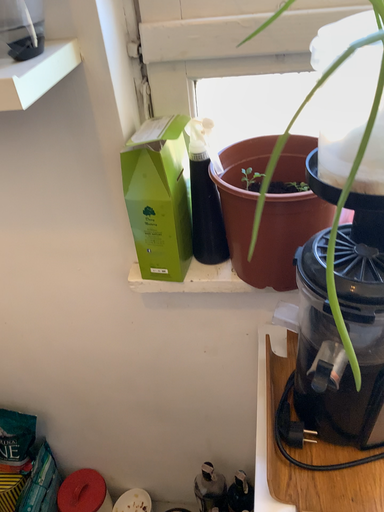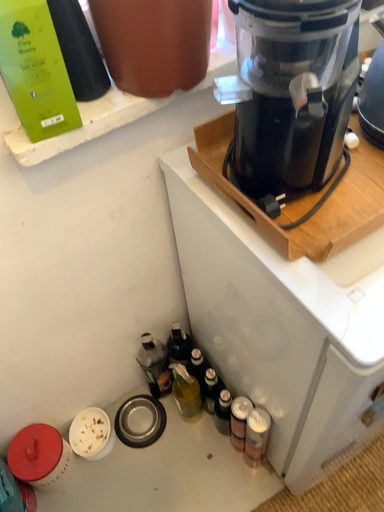
Question: Which way did the camera rotate in the video?

Choices:
 (A) rotated left
 (B) rotated right

Answer: (B)